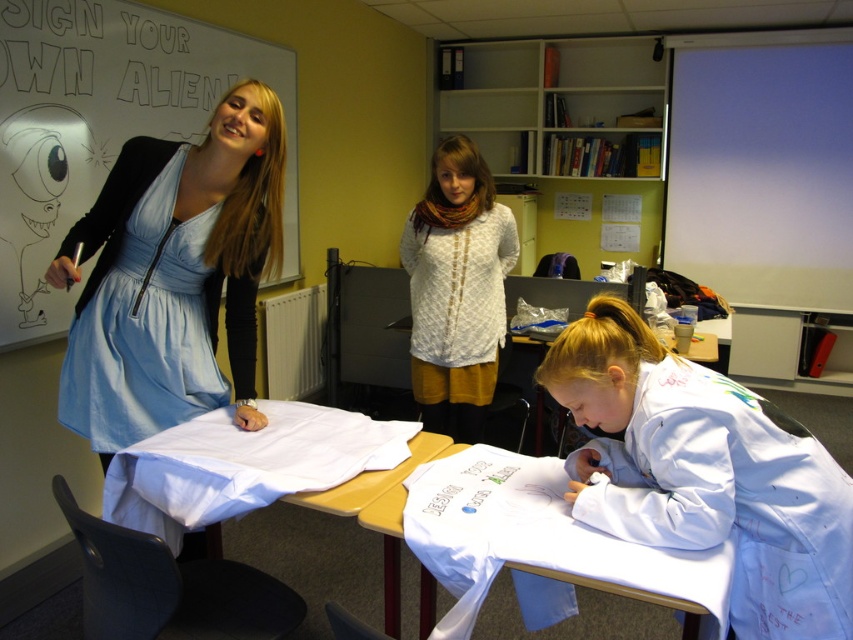
Is point (370, 515) positioned behind point (209, 506)?

No, (370, 515) is in front of (209, 506).

Which is more to the right, white paper at lower center or white fabric at center?

white paper at lower center

Which is behind, point (368, 508) or point (334, 493)?

The point (334, 493) is behind.

Locate an element on the screen. The width and height of the screenshot is (853, 640). white paper at lower center is located at coordinates (529, 536).

Which of these two, white paper at lower center or matte blue dress at upper left, stands taller?

Standing taller between the two is matte blue dress at upper left.

Locate an element on the screen. white paper at lower center is located at coordinates (529, 536).

Who is higher up, whiteboard at upper left or white lace sweater at center?

whiteboard at upper left

Locate an element on the screen. The image size is (853, 640). whiteboard at upper left is located at coordinates (103, 125).

Locate an element on the screen. This screenshot has width=853, height=640. whiteboard at upper left is located at coordinates (103, 125).